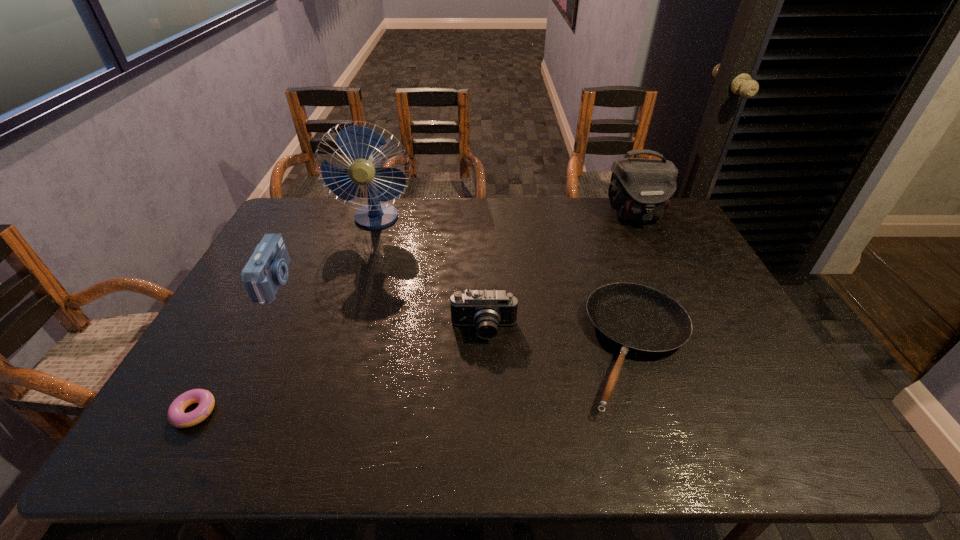
At what (x,y) coordinates should I click in order to perform the action: click on vacant space in between the shortest object and the nearer camera. Please return your answer as a coordinate pair (x, y). The image size is (960, 540). Looking at the image, I should click on (339, 371).

You are a GUI agent. You are given a task and a screenshot of the screen. Output one action in this format:
    pyautogui.click(x=<x>, y=<y>)
    Task: Click on the free spot between the tallest object and the frying pan
    The height and width of the screenshot is (540, 960).
    Given the screenshot: What is the action you would take?
    pyautogui.click(x=507, y=284)

This screenshot has width=960, height=540. In order to click on empty location between the fifth shortest object and the doughnut in this screenshot , I will do `click(415, 313)`.

Identify the location of free space between the fifth shortest object and the second shortest object. (636, 281).

This screenshot has width=960, height=540. Find the location of `vacant point located between the right camera and the shoulder bag`. vacant point located between the right camera and the shoulder bag is located at coordinates (560, 272).

Locate an element on the screen. empty location between the shoulder bag and the tallest object is located at coordinates (506, 217).

In order to click on unoccupied area between the tallest object and the right camera in this screenshot , I will do `click(430, 274)`.

This screenshot has height=540, width=960. Find the location of `vacant point located between the nearer camera and the frying pan`. vacant point located between the nearer camera and the frying pan is located at coordinates (561, 339).

What are the coordinates of `unoccupied area between the fan and the shoulder bag` in the screenshot? It's located at point(506,217).

Identify which object is located as the fifth nearest to the right camera. Please provide its 2D coordinates. Your answer should be formatted as a tuple, i.e. [(x, y)], where the tuple contains the x and y coordinates of a point satisfying the conditions above.

[(641, 189)]